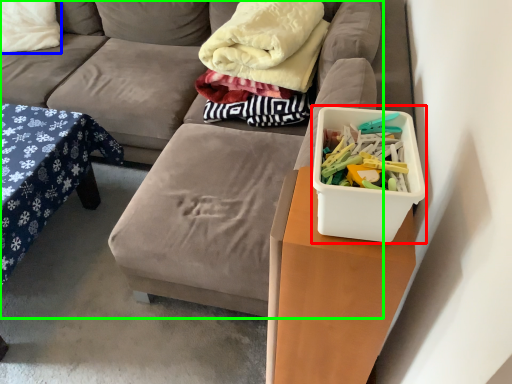
Question: Which object is positioned farthest from storage box (highlighted by a red box)? Select from pillow (highlighted by a blue box) and studio couch (highlighted by a green box).

Choices:
 (A) pillow
 (B) studio couch

Answer: (A)